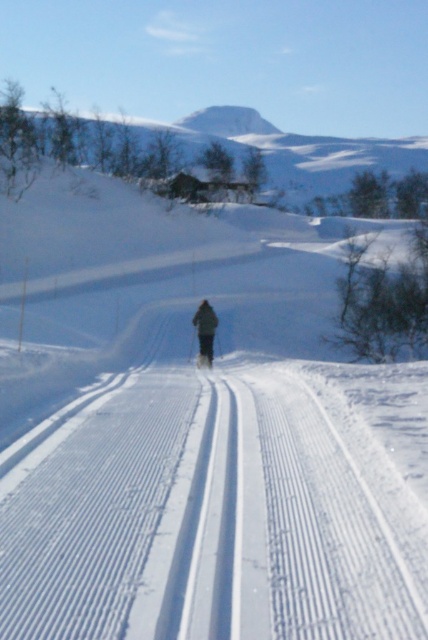
Question: Can you confirm if dark green fabric at center is positioned to the right of white matte ski at center?

Choices:
 (A) yes
 (B) no

Answer: (B)

Question: Can you confirm if dark green fabric at center is positioned above white matte ski at center?

Choices:
 (A) no
 (B) yes

Answer: (B)

Question: Which point is farther to the camera?

Choices:
 (A) white matte ski at center
 (B) dark green fabric at center

Answer: (A)

Question: From the image, what is the correct spatial relationship of dark green fabric at center in relation to white matte ski at center?

Choices:
 (A) below
 (B) above

Answer: (B)

Question: Which object appears closest to the camera in this image?

Choices:
 (A) white matte ski at center
 (B) dark green fabric at center

Answer: (B)